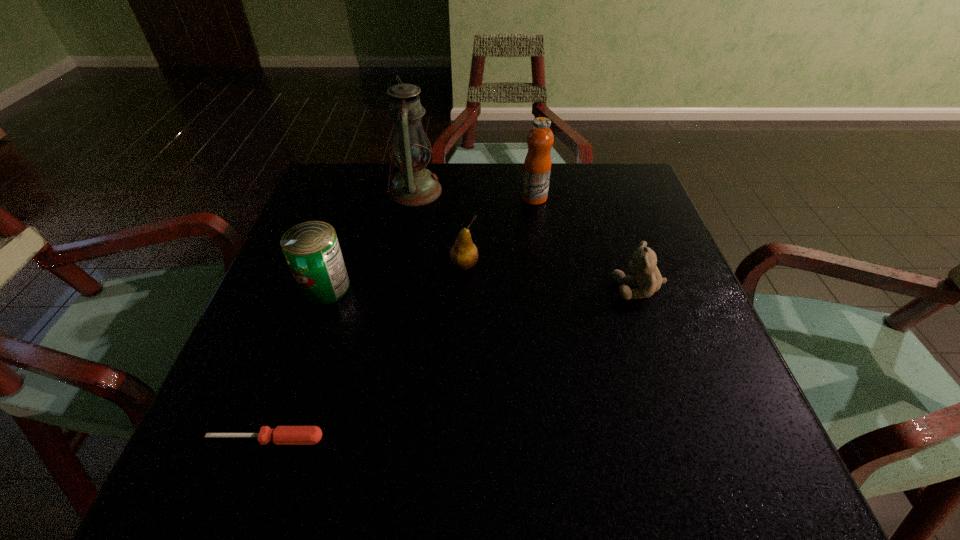
At what (x,y) coordinates should I click in order to perform the action: click on vacant space situated 0.360m on the front of the oil lamp. Please return your answer as a coordinate pair (x, y). The height and width of the screenshot is (540, 960). Looking at the image, I should click on (392, 325).

Identify the location of vacant space located 0.130m on the left of the fifth shortest object. (470, 198).

Where is `free space located on the right of the can`? The width and height of the screenshot is (960, 540). free space located on the right of the can is located at coordinates (403, 287).

The image size is (960, 540). In order to click on vacant space located 0.210m on the back of the fourth object from left to right in this screenshot , I will do `click(467, 200)`.

The width and height of the screenshot is (960, 540). Identify the location of vacant space located 0.380m on the face of the rightmost object. (426, 288).

This screenshot has height=540, width=960. Identify the location of free space located 0.140m on the face of the rightmost object. (544, 288).

This screenshot has width=960, height=540. Find the location of `vacant space located 0.190m on the face of the rightmost object`. vacant space located 0.190m on the face of the rightmost object is located at coordinates (519, 288).

Where is `vacant space located 0.100m on the right of the screwdriver`? The width and height of the screenshot is (960, 540). vacant space located 0.100m on the right of the screwdriver is located at coordinates click(389, 439).

Where is `oil lamp present at the far edge`? The width and height of the screenshot is (960, 540). oil lamp present at the far edge is located at coordinates (414, 185).

Where is `fruit juice present at the far edge`? This screenshot has height=540, width=960. fruit juice present at the far edge is located at coordinates (537, 166).